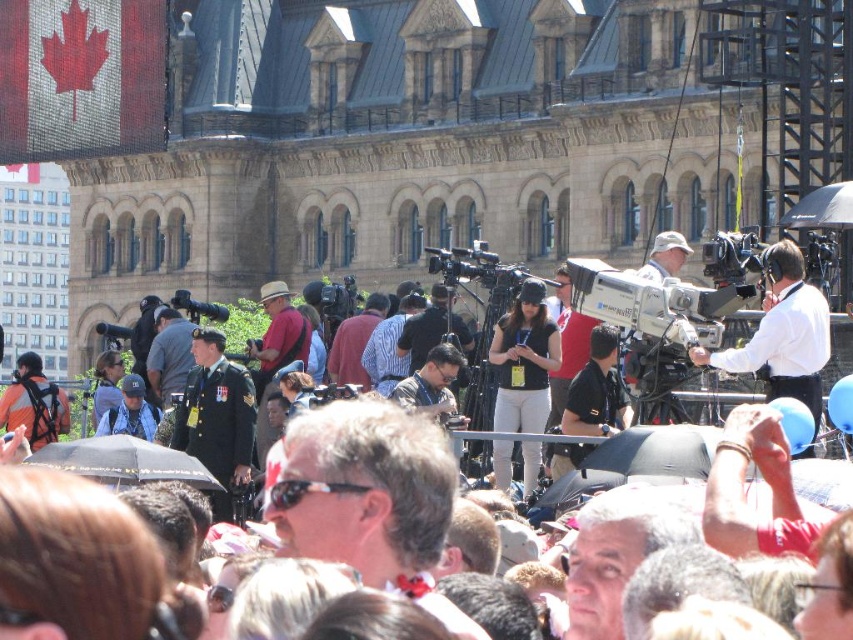
You are a photographer at the event and need to capture a shot of the white shirt at right and the matte black camera at center. Which object should you focus on first if you want to prioritize the closer one?

The white shirt at right is smaller than the matte black camera at center, which indicates it is farther away. Therefore, you should focus on the matte black camera at center first as it is closer.

You are a photographer at the event and need to capture a photo of both the white shirt at right and the white cotton pants at center in the same frame. Given that your camera has a maximum focal length that allows capturing objects up to 40 feet apart in the same shot, will you be able to include both subjects in your photo?

The white shirt at right and white cotton pants at center are 41.82 feet apart, which exceeds the camera maximum focal length of 40 feet. Therefore, you cannot capture both subjects in the same frame.

You are a photographer at the event and want to capture a wide shot of the crowd while ensuring the white cotton pants at center are in the frame. Given their coordinates, where should you position your camera to include them?

The white cotton pants at center are located at coordinates point (524, 362), so positioning the camera centrally would ensure they are included in the frame.